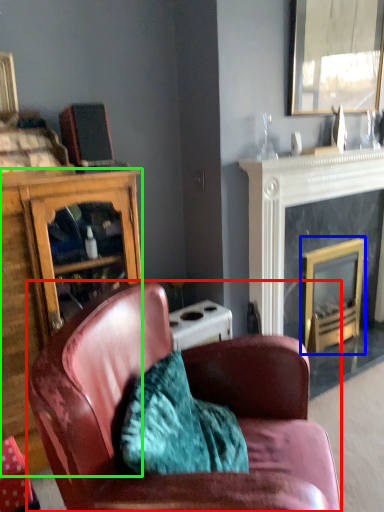
Question: Which is farther away from chair (highlighted by a red box)? fireplace (highlighted by a blue box) or cabinetry (highlighted by a green box)?

Choices:
 (A) fireplace
 (B) cabinetry

Answer: (A)